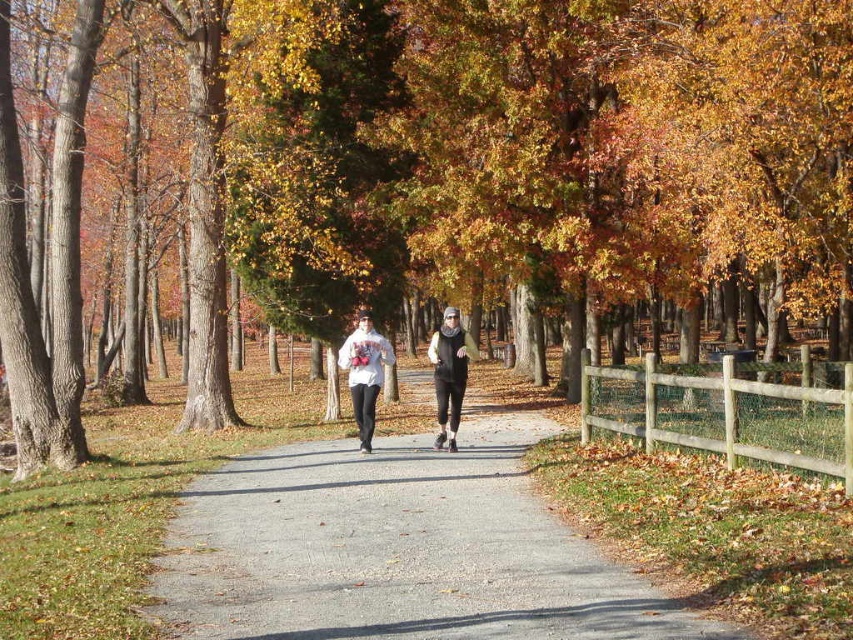
You are standing at the starting point of the path in the autumn scene. You want to reach the brown wood fence at center located at point [512,152]. Which direction should you head towards?

The brown wood fence at center is located at point [512,152], so you should head towards the center of the image to reach it.

You are a photographer trying to capture both the white fleece hoodie at center and the black matte jacket at center in the same frame. Based on their positions, which clothing item is positioned more to the left?

The white fleece hoodie at center is positioned more to the left than the black matte jacket at center.

You are a photographer standing at the end of the path in the autumn scene. You want to take a photo of the two runners so that the brown wood fence at center is visible above the white matte sweatshirt at center. Is this possible given their current positions?

Yes, because the brown wood fence at center is already positioned above the white matte sweatshirt at center, allowing the photographer to capture the scene as desired.